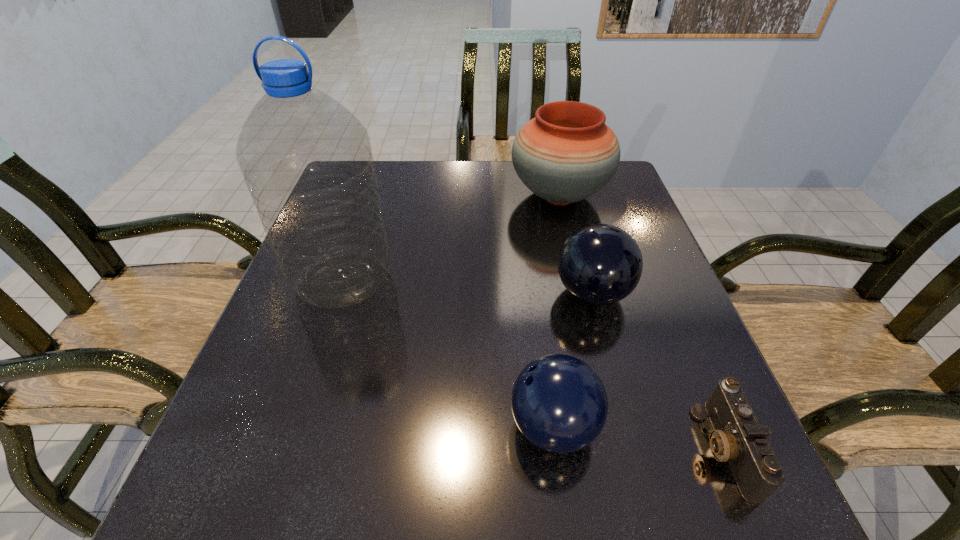
At what (x,y) coordinates should I click in order to perform the action: click on free region located on the side of the farther bowling ball with the finger holes. Please return your answer as a coordinate pair (x, y). Image resolution: width=960 pixels, height=540 pixels. Looking at the image, I should click on (395, 294).

Identify the location of free space located 0.050m on the side of the farther bowling ball with the finger holes. (531, 294).

At what (x,y) coordinates should I click in order to perform the action: click on vacant space located 0.190m on the surface of the nearer bowling ball near the finger holes. Please return your answer as a coordinate pair (x, y). This screenshot has height=540, width=960. Looking at the image, I should click on [393, 427].

Identify the location of free space located 0.340m on the surface of the nearer bowling ball near the finger holes. This screenshot has height=540, width=960. (300, 427).

At what (x,y) coordinates should I click in order to perform the action: click on vacant area located 0.140m on the surface of the nearer bowling ball near the finger holes. Please return your answer as a coordinate pair (x, y). The width and height of the screenshot is (960, 540). Looking at the image, I should click on (423, 427).

The image size is (960, 540). I want to click on vacant position located on the front-facing side of the camera, so (x=492, y=449).

The image size is (960, 540). In order to click on free location located 0.190m on the front-facing side of the camera in this screenshot , I will do `click(581, 449)`.

In order to click on vacant point located 0.130m on the front-facing side of the camera in this screenshot , I will do `click(619, 449)`.

This screenshot has width=960, height=540. I want to click on object located at the far edge, so click(567, 153).

Locate an element on the screen. object situated at the near edge is located at coordinates click(x=738, y=438).